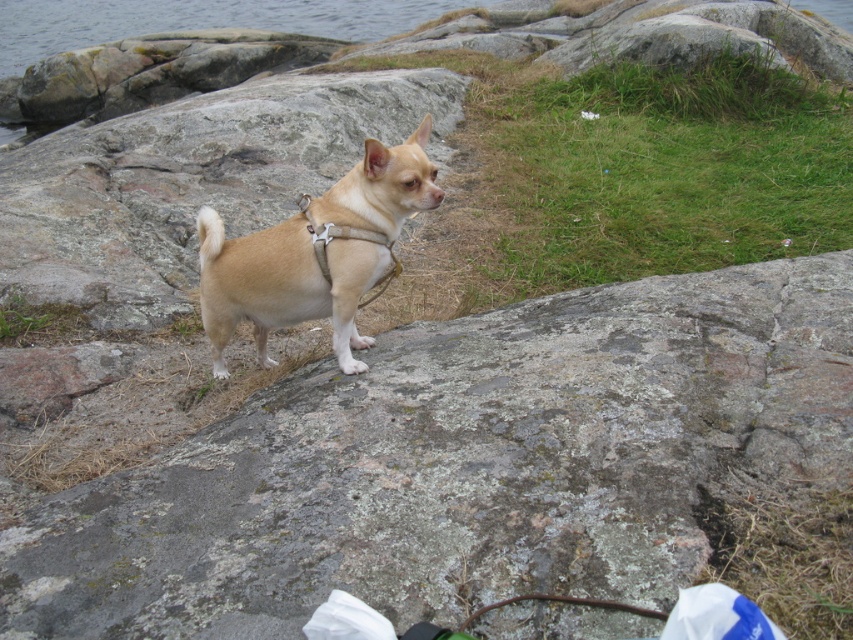
You are a dog owner who wants to ensure your Chihuahua stays safe while walking on the rocky terrain. The dog is wearing a tan matte harness at center and standing near a smooth gray rock at center. Which object is positioned lower in the image?

The smooth gray rock at center is located below the tan matte harness at center, so the rock is positioned lower in the image.

You are a photographer trying to capture the tan matte harness at center. You notice the smooth gray rock at center is blocking your view. Can you move the rock to get a clear shot of the harness?

The smooth gray rock at center is in front of the tan matte harness at center, so moving the rock would allow you to see the harness clearly.